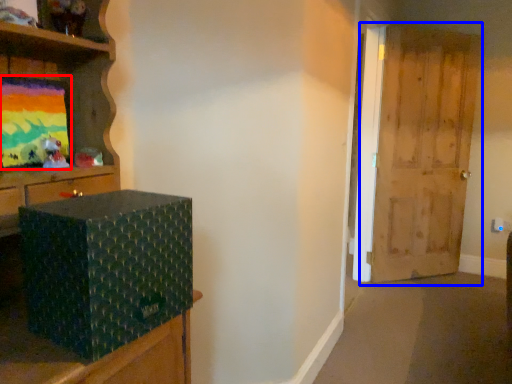
Question: Among these objects, which one is farthest to the camera, picture frame (highlighted by a red box) or door (highlighted by a blue box)?

Choices:
 (A) picture frame
 (B) door

Answer: (B)